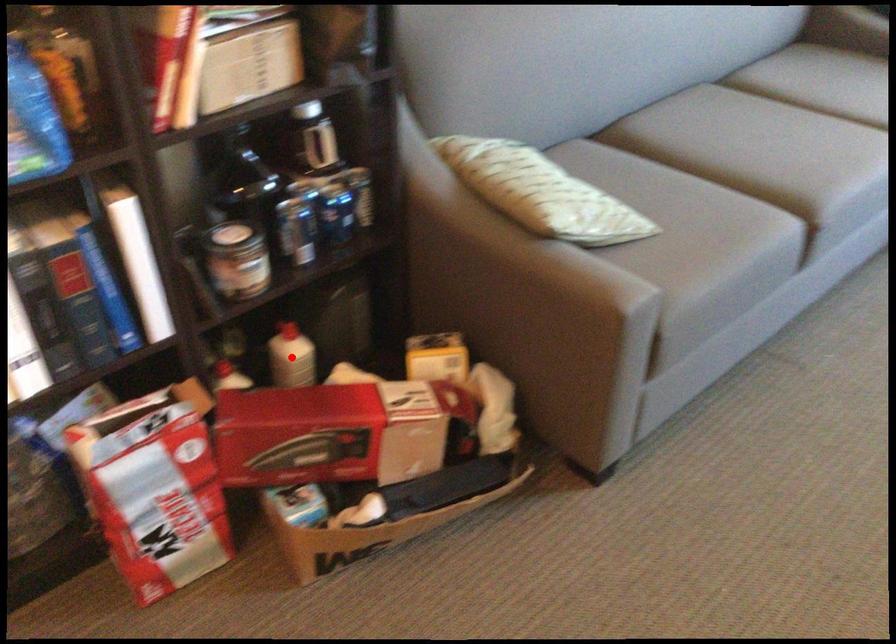
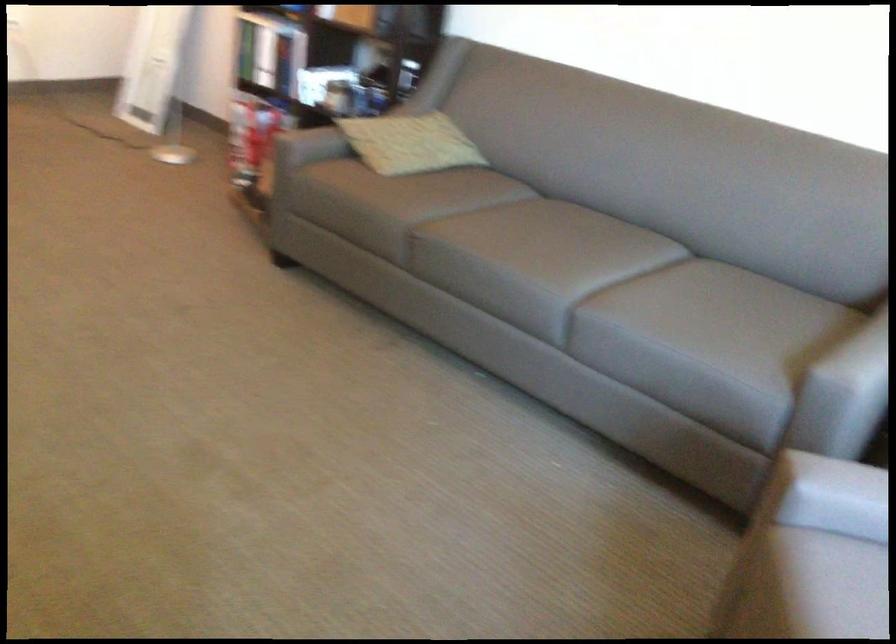
Question: I am providing you with two images of the same scene from different viewpoints. A red point is marked on the first image. Can you still see the location of the red point in image 2?

Choices:
 (A) Yes
 (B) No

Answer: (B)